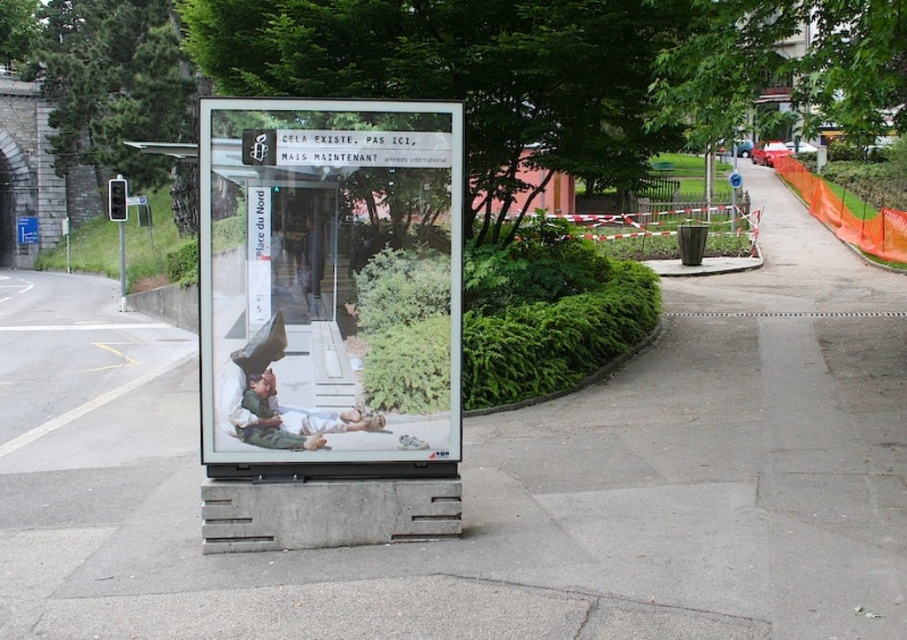
Between clear glass billboard at center and white cotton shirt at center, which one is positioned higher?

clear glass billboard at center

Who is shorter, clear glass billboard at center or white cotton shirt at center?

With less height is white cotton shirt at center.

Measure the distance between clear glass billboard at center and camera.

clear glass billboard at center and camera are 4.73 meters apart from each other.

This screenshot has height=640, width=907. Identify the location of clear glass billboard at center. (329, 321).